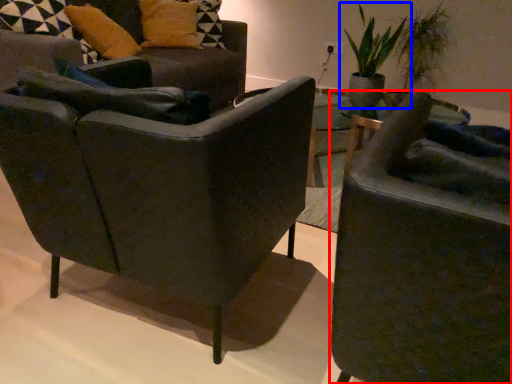
Question: Which of the following is the farthest to the observer, chair (highlighted by a red box) or houseplant (highlighted by a blue box)?

Choices:
 (A) chair
 (B) houseplant

Answer: (B)